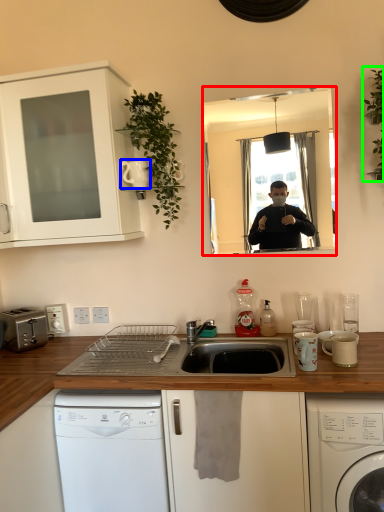
Question: Considering the real-world distances, which object is farthest from mirror (highlighted by a red box)? appliance (highlighted by a blue box) or plant (highlighted by a green box)?

Choices:
 (A) appliance
 (B) plant

Answer: (A)